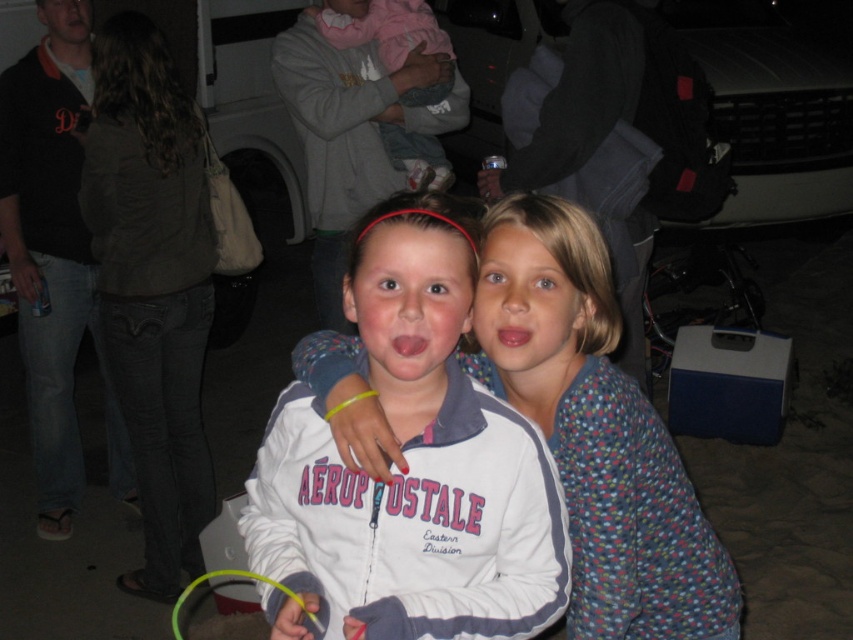
You are a photographer trying to capture a clear shot of both the white fleece jacket at center and the matte blue face at center in the image. Based on their positions, which object should you focus on first to ensure both are in frame?

The white fleece jacket at center is positioned on the left side of matte blue face at center, so you should focus on the white fleece jacket at center first to ensure both are in frame.

You are a photographer trying to capture a closeup of the matte blue face at center and the fluffy pink blanket at upper center. Which object should you zoom in on to ensure both are in focus without moving the camera?

The fluffy pink blanket at upper center is larger than the matte blue face at center, so zooming in on the larger object will ensure both are in focus.

You are a photographer trying to focus on the white fleece jacket at center and the matte blue face at center in the image. Which object should you adjust your focus to first if you want to ensure both are in focus?

The white fleece jacket at center is closer to the viewer than the matte blue face at center, so you should focus on the white fleece jacket at center first to ensure both are in focus.